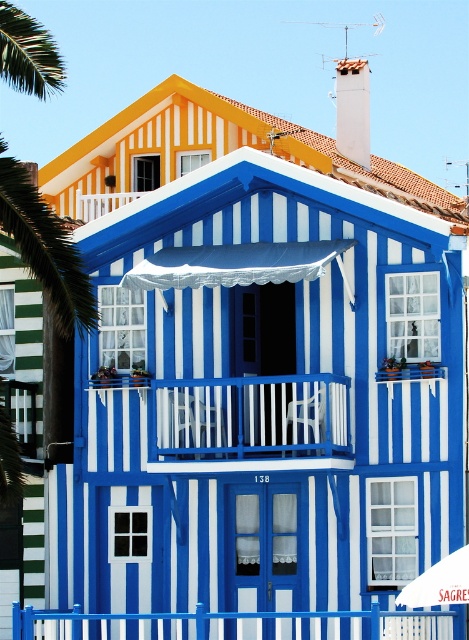
Question: Which object is positioned closest to the white plastic chair at center?

Choices:
 (A) white fabric umbrella at center
 (B) green leafy palm tree at left
 (C) blue striped house at center
 (D) blue painted metal fence at lower center

Answer: (C)

Question: From the image, what is the correct spatial relationship of blue striped house at center in relation to green leafy palm tree at left?

Choices:
 (A) above
 (B) below

Answer: (B)

Question: Based on their relative distances, which object is farther from the white plastic chair at center?

Choices:
 (A) blue striped house at center
 (B) green leafy palm tree at left
 (C) blue painted metal fence at lower center
 (D) white fabric umbrella at center

Answer: (D)

Question: Estimate the real-world distances between objects in this image. Which object is farther from the blue striped house at center?

Choices:
 (A) blue painted metal fence at lower center
 (B) white fabric umbrella at center

Answer: (B)

Question: Does blue painted metal fence at lower center have a larger size compared to white fabric umbrella at center?

Choices:
 (A) yes
 (B) no

Answer: (A)

Question: Does blue striped house at center have a smaller size compared to white plastic chair at center?

Choices:
 (A) yes
 (B) no

Answer: (B)